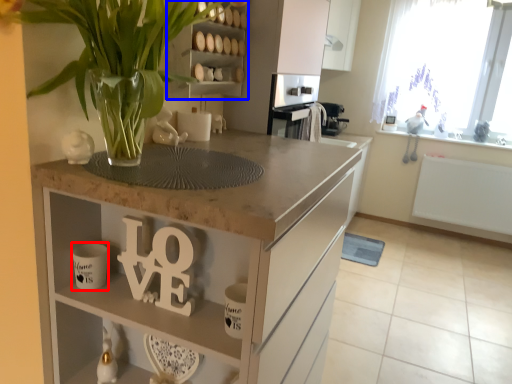
Question: Which object appears closest to the camera in this image, mug (highlighted by a red box) or cabinet (highlighted by a blue box)?

Choices:
 (A) mug
 (B) cabinet

Answer: (A)